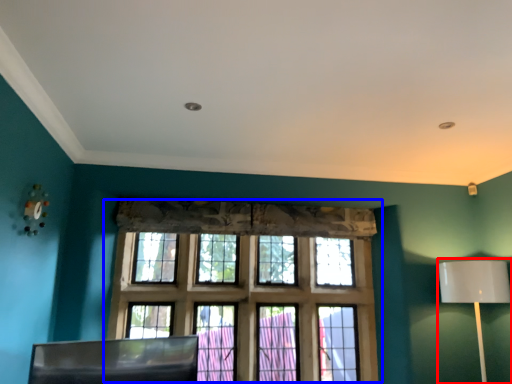
Question: Which object appears farthest to the camera in this image, table lamp (highlighted by a red box) or window (highlighted by a blue box)?

Choices:
 (A) table lamp
 (B) window

Answer: (B)